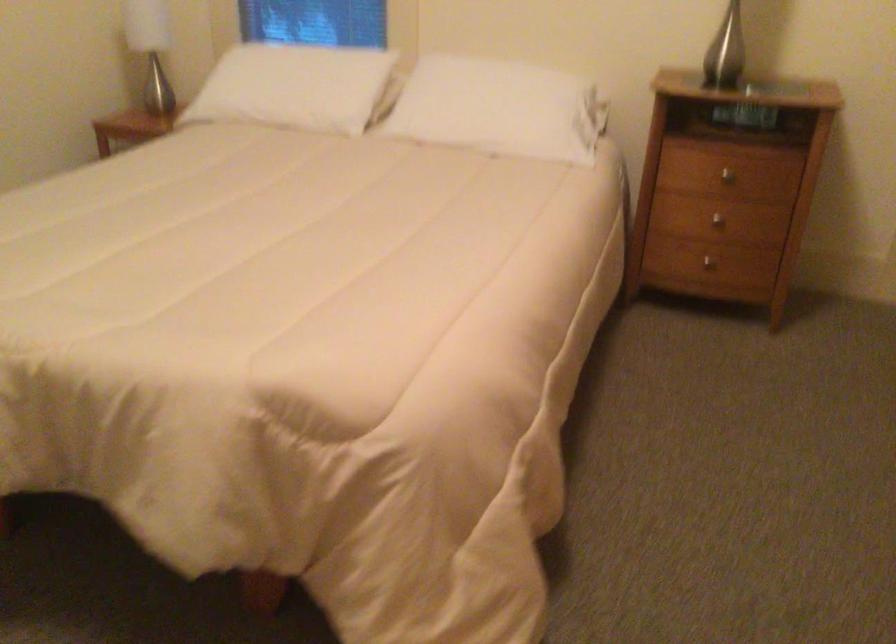
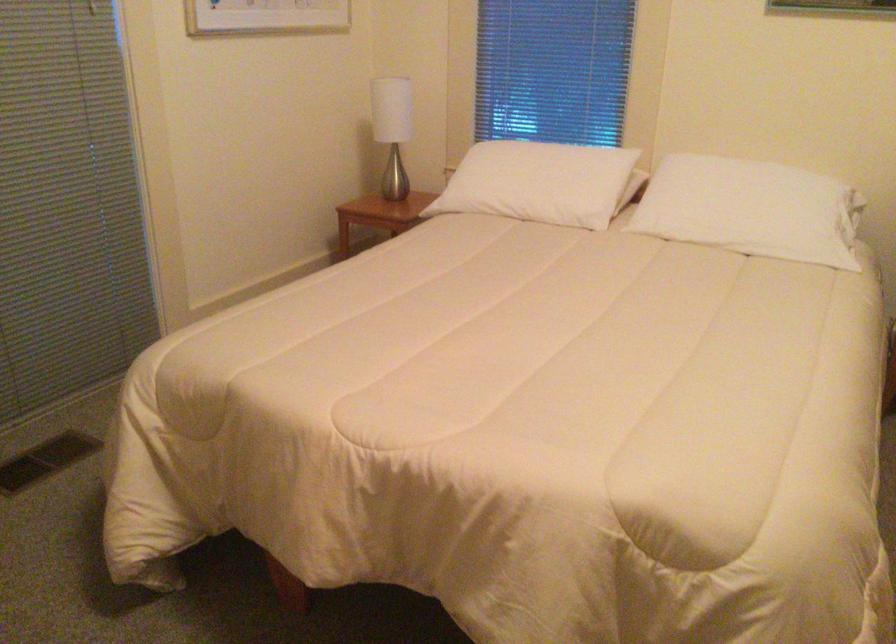
Find the pixel in the second image that matches point 285,90 in the first image.

(538, 183)